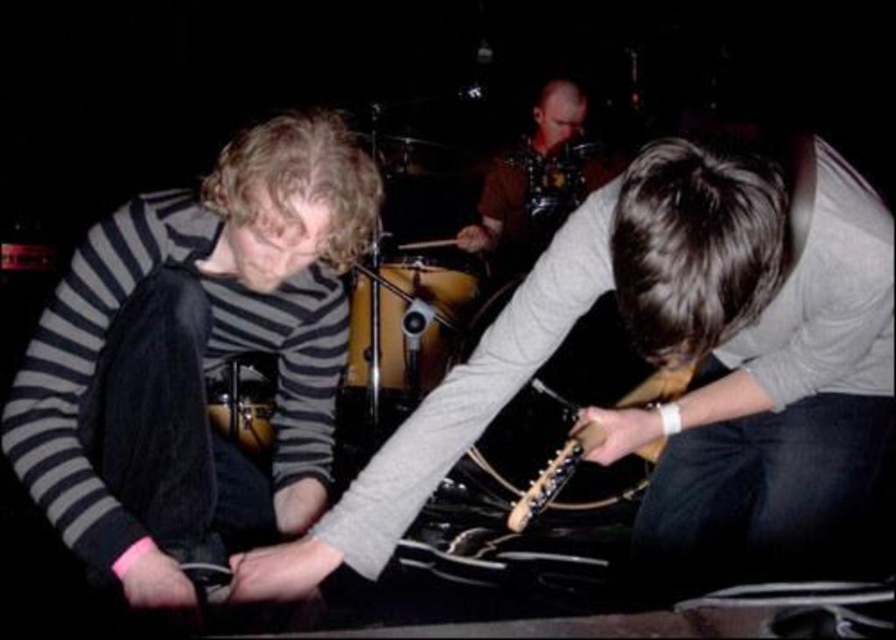
Image resolution: width=896 pixels, height=640 pixels. What are the coordinates of `wooden electric guitar at center` in the screenshot? It's located at (678, 360).

Which is below, wooden electric guitar at center or brown leather jacket at center?

Positioned lower is wooden electric guitar at center.

Locate an element on the screen. Image resolution: width=896 pixels, height=640 pixels. wooden electric guitar at center is located at coordinates (678, 360).

Does point (521, 243) come behind point (549, 497)?

Yes, point (521, 243) is behind point (549, 497).

From the picture: Who is more forward, [610,161] or [668,364]?

Point [668,364] is more forward.

You are a GUI agent. You are given a task and a screenshot of the screen. Output one action in this format:
    pyautogui.click(x=<x>, y=<y>)
    Task: Click on the brown leather jacket at center
    
    Given the screenshot: What is the action you would take?
    pyautogui.click(x=537, y=180)

Between point (256, 129) and point (676, 378), which one is positioned in front?

Point (256, 129) is more forward.

Does striped fabric shirt at left lie in front of wooden electric guitar at lower center?

Yes.

Identify the location of striped fabric shirt at left. The width and height of the screenshot is (896, 640). (194, 356).